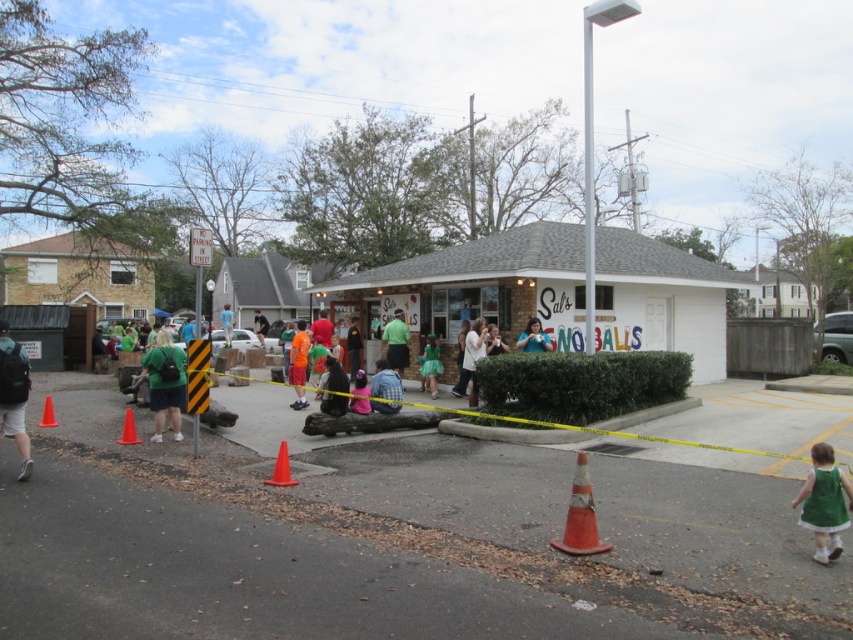
Based on the photo, you are standing at the entrance of Sal s Sno Balls and want to know if you can walk directly from the white matte building at center to the pink fabric dress at center without needing to move any objects. Can you do this?

The white matte building at center and pink fabric dress at center are 24.25 feet apart from each other, so yes, you can walk directly between them without needing to move any objects since there is enough space between them.

You are a customer standing at the entrance of Sal s Sno Balls. You notice a green backpack at left and an orange fabric pants at center. Which item is closer to the ground?

The green backpack at left is shorter than orange fabric pants at center, so the green backpack at left is closer to the ground.

You are a photographer trying to capture a photo of the white matte building at center and the pink fabric dress at center from a specific angle. Based on their positions, which object would be more likely to block the view of the other in the photo?

The white matte building at center is positioned over the pink fabric dress at center, so it would block the view of the pink fabric dress at center in the photo.